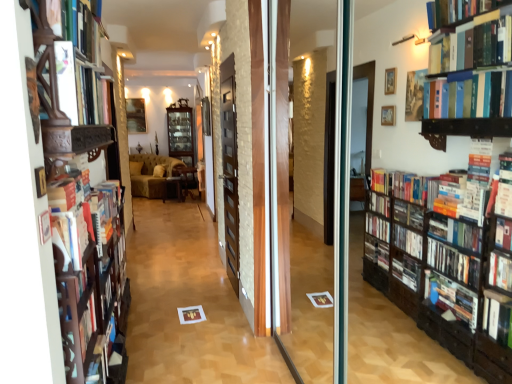
Question: Does wooden bookshelf at left have a smaller size compared to matte white book at left, which is the first book from bottom to top?

Choices:
 (A) yes
 (B) no

Answer: (B)

Question: Are wooden bookshelf at left and matte white book at left, which is counted as the 2th book, starting from the top, located far from each other?

Choices:
 (A) yes
 (B) no

Answer: (B)

Question: Can you confirm if wooden bookshelf at left is positioned to the left of matte white book at left, which is counted as the 2th book, starting from the top?

Choices:
 (A) yes
 (B) no

Answer: (A)

Question: Does wooden bookshelf at left have a larger size compared to matte white book at left, which is counted as the 2th book, starting from the top?

Choices:
 (A) yes
 (B) no

Answer: (A)

Question: Is wooden bookshelf at left at the right side of matte white book at left, which is counted as the 2th book, starting from the top?

Choices:
 (A) no
 (B) yes

Answer: (A)

Question: Can you confirm if wooden bookshelf at left is taller than matte white book at left, which is counted as the 2th book, starting from the top?

Choices:
 (A) yes
 (B) no

Answer: (A)

Question: From a real-world perspective, is wooden bookshelf at left located beneath matte brown paper at center?

Choices:
 (A) yes
 (B) no

Answer: (B)

Question: Is the surface of wooden bookshelf at left in direct contact with matte brown paper at center?

Choices:
 (A) yes
 (B) no

Answer: (B)

Question: Is matte brown paper at center inside wooden bookshelf at left?

Choices:
 (A) yes
 (B) no

Answer: (B)

Question: Can you confirm if wooden bookshelf at left is bigger than matte brown paper at center?

Choices:
 (A) no
 (B) yes

Answer: (B)

Question: Can you confirm if wooden bookshelf at left is taller than matte brown paper at center?

Choices:
 (A) no
 (B) yes

Answer: (B)

Question: Is wooden bookshelf at left far from matte brown paper at center?

Choices:
 (A) yes
 (B) no

Answer: (A)

Question: From the image's perspective, does matte white book at upper left, which ranks as the 1th book in top-to-bottom order, appear lower than wooden table at center, the third furniture positioned from the left?

Choices:
 (A) no
 (B) yes

Answer: (A)